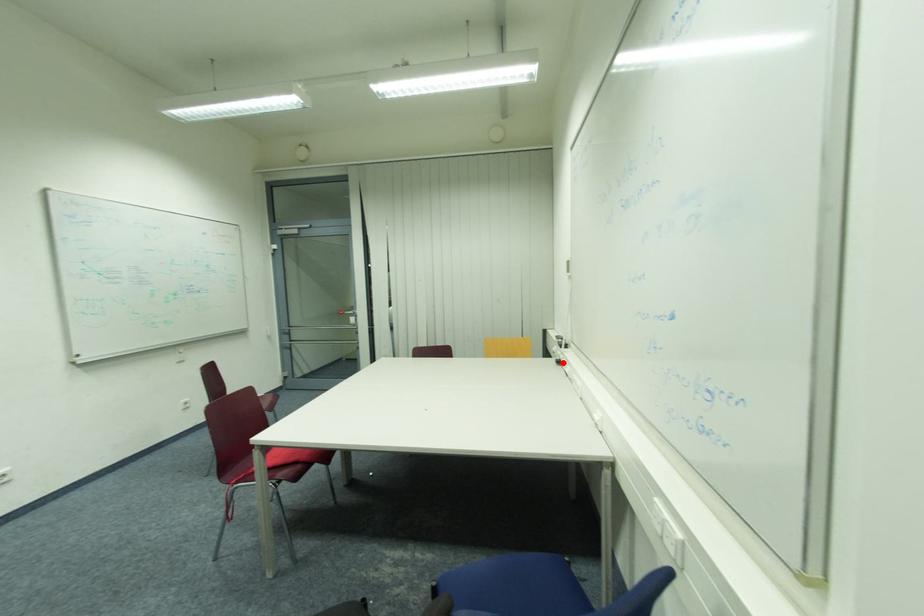
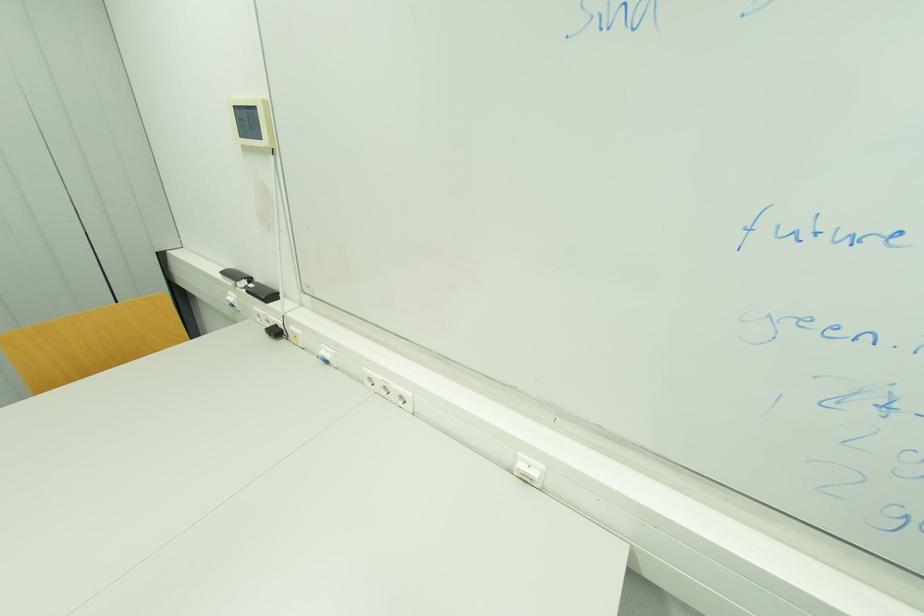
Question: I am providing you with two images of the same scene from different viewpoints. In image1, a red point is highlighted. Considering the same 3D point in image2, which of the following is correct?

Choices:
 (A) It is closer
 (B) It is farther

Answer: (B)